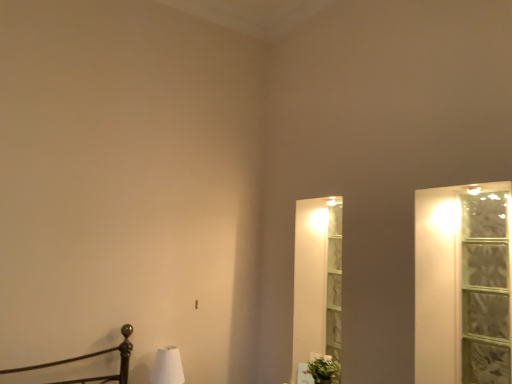
The height and width of the screenshot is (384, 512). What do you see at coordinates (167, 367) in the screenshot?
I see `white matte table lamp at lower left` at bounding box center [167, 367].

The height and width of the screenshot is (384, 512). What are the coordinates of `clear glass window at right` in the screenshot? It's located at 463,284.

Which of these two, green leafy plant at lower right or white matte table lamp at lower left, is bigger?

With larger size is white matte table lamp at lower left.

Which is behind, point (326, 366) or point (170, 359)?

The point (170, 359) is more distant.

Is there a large distance between green leafy plant at lower right and white matte table lamp at lower left?

green leafy plant at lower right is actually quite close to white matte table lamp at lower left.

Locate an element on the screen. table lamp above the green leafy plant at lower right (from a real-world perspective) is located at coordinates (167, 367).

Can you confirm if clear glass window at right is smaller than green leafy plant at lower right?

No, clear glass window at right is not smaller than green leafy plant at lower right.

Is clear glass window at right aimed at green leafy plant at lower right?

No, clear glass window at right does not turn towards green leafy plant at lower right.

Between clear glass window at right and green leafy plant at lower right, which one has less height?

green leafy plant at lower right is shorter.

From the image's perspective, which one is positioned higher, white matte table lamp at lower left or clear glass window at right?

clear glass window at right is shown above in the image.

The width and height of the screenshot is (512, 384). What are the coordinates of `window frame on the right of the white matte table lamp at lower left` in the screenshot? It's located at (463, 284).

Considering the relative sizes of white matte table lamp at lower left and clear glass window at right in the image provided, is white matte table lamp at lower left shorter than clear glass window at right?

Correct, white matte table lamp at lower left is not as tall as clear glass window at right.

Would you say white matte table lamp at lower left is a long distance from clear glass window at right?

Yes.

From the picture: Between clear glass window at right and white matte table lamp at lower left, which one has more height?

With more height is clear glass window at right.

Is point (421, 370) closer or farther from the camera than point (156, 372)?

Point (421, 370).

Who is bigger, clear glass window at right or white matte table lamp at lower left?

clear glass window at right is bigger.

Is clear glass window at right oriented away from white matte table lamp at lower left?

No, clear glass window at right's orientation is not away from white matte table lamp at lower left.

Does green leafy plant at lower right have a lesser height compared to clear glass window at right?

Yes, green leafy plant at lower right is shorter than clear glass window at right.

Is green leafy plant at lower right completely or partially outside of clear glass window at right?

Yes, green leafy plant at lower right is outside of clear glass window at right.

From the image's perspective, is green leafy plant at lower right on clear glass window at right?

Actually, green leafy plant at lower right appears below clear glass window at right in the image.

Which object is positioned more to the left, green leafy plant at lower right or clear glass window at right?

green leafy plant at lower right.

Considering the relative sizes of white matte table lamp at lower left and green leafy plant at lower right in the image provided, is white matte table lamp at lower left thinner than green leafy plant at lower right?

No, white matte table lamp at lower left is not thinner than green leafy plant at lower right.

Between white matte table lamp at lower left and green leafy plant at lower right, which one has larger size?

white matte table lamp at lower left.

Considering the positions of point (183, 380) and point (313, 357), is point (183, 380) closer or farther from the camera than point (313, 357)?

Point (183, 380) appears to be closer to the viewer than point (313, 357).

In the scene shown: Between white matte table lamp at lower left and green leafy plant at lower right, which one has more height?

white matte table lamp at lower left is taller.

The height and width of the screenshot is (384, 512). Find the location of `table lamp above the green leafy plant at lower right (from a real-world perspective)`. table lamp above the green leafy plant at lower right (from a real-world perspective) is located at coordinates (167, 367).

What are the coordinates of `plant located underneath the clear glass window at right (from a real-world perspective)` in the screenshot? It's located at (323, 368).

Estimate the real-world distances between objects in this image. Which object is further from white matte table lamp at lower left, green leafy plant at lower right or clear glass window at right?

The object further to white matte table lamp at lower left is clear glass window at right.

Looking at the image, which one is located further to clear glass window at right, white matte table lamp at lower left or green leafy plant at lower right?

Among the two, white matte table lamp at lower left is located further to clear glass window at right.

Which object lies nearer to the anchor point green leafy plant at lower right, clear glass window at right or white matte table lamp at lower left?

The object closer to green leafy plant at lower right is clear glass window at right.

Looking at the image, which one is located further to clear glass window at right, green leafy plant at lower right or white matte table lamp at lower left?

Among the two, white matte table lamp at lower left is located further to clear glass window at right.

Based on their spatial positions, is white matte table lamp at lower left or clear glass window at right further from green leafy plant at lower right?

white matte table lamp at lower left is further to green leafy plant at lower right.

Estimate the real-world distances between objects in this image. Which object is closer to white matte table lamp at lower left, clear glass window at right or green leafy plant at lower right?

The object closer to white matte table lamp at lower left is green leafy plant at lower right.

The image size is (512, 384). I want to click on plant located between white matte table lamp at lower left and clear glass window at right in the left-right direction, so tap(323, 368).